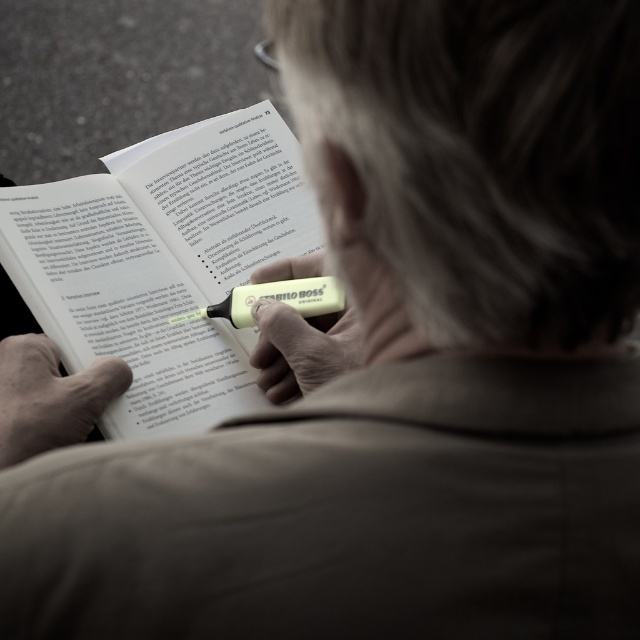
Is yellow highlighter at center to the right of smooth beige hand at lower left from the viewer's perspective?

Indeed, yellow highlighter at center is positioned on the right side of smooth beige hand at lower left.

The image size is (640, 640). In order to click on yellow highlighter at center in this screenshot , I will do coord(163,262).

Is smooth beige hand at lower left closer to camera compared to yellow matte highlighter at center?

Yes.

Is point (72, 387) in front of point (272, 275)?

That is True.

The image size is (640, 640). I want to click on smooth beige hand at lower left, so click(x=49, y=396).

The height and width of the screenshot is (640, 640). Find the location of `smooth beige hand at lower left`. smooth beige hand at lower left is located at coordinates (49, 396).

Is point (106, 230) positioned behind point (288, 376)?

Yes, point (106, 230) is behind point (288, 376).

Who is positioned more to the right, yellow highlighter at center or yellow matte highlighter at center?

yellow matte highlighter at center is more to the right.

Measure the distance between yellow highlighter at center and camera.

yellow highlighter at center and camera are 33.01 inches apart from each other.

Image resolution: width=640 pixels, height=640 pixels. What are the coordinates of `yellow highlighter at center` in the screenshot? It's located at (163, 262).